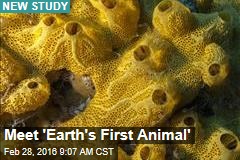
Locate an element on the screen. sponge is located at coordinates (186, 25).